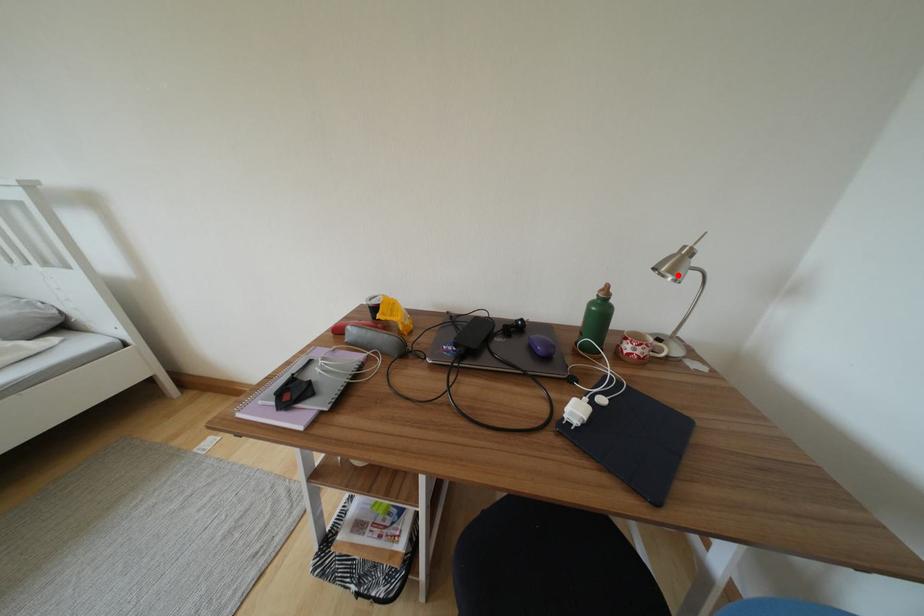
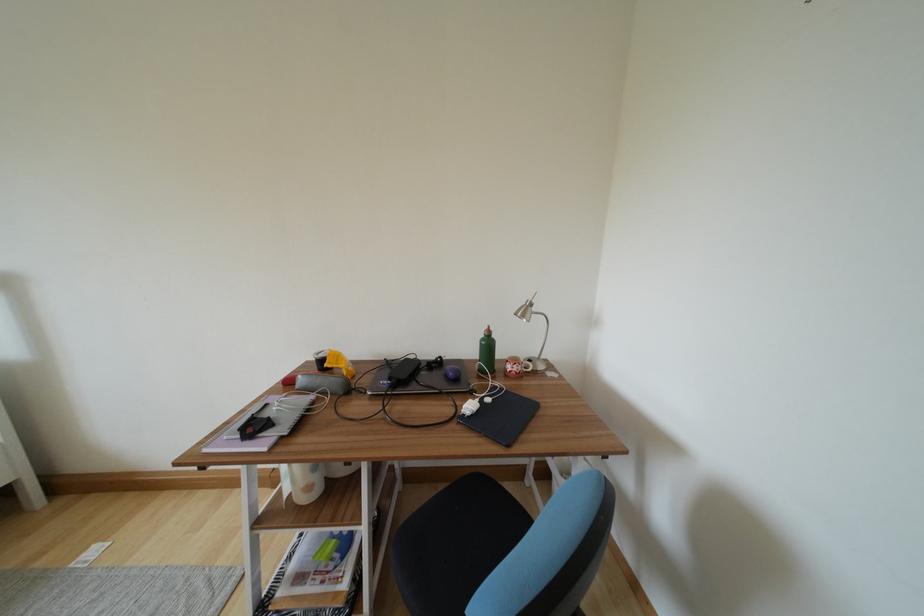
Where in the second image is the point corresponding to the highlighted location from the first image?

(528, 320)